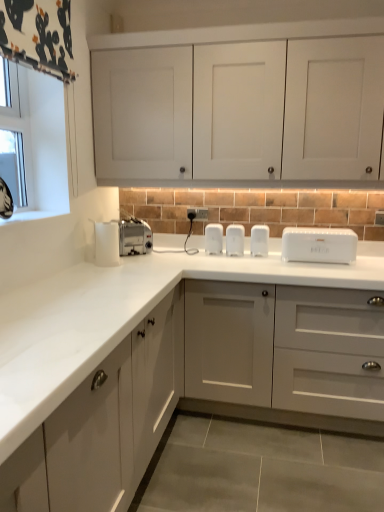
Where is `vacant area that is in front of white plastic bread bin at center`? The image size is (384, 512). vacant area that is in front of white plastic bread bin at center is located at coordinates (335, 264).